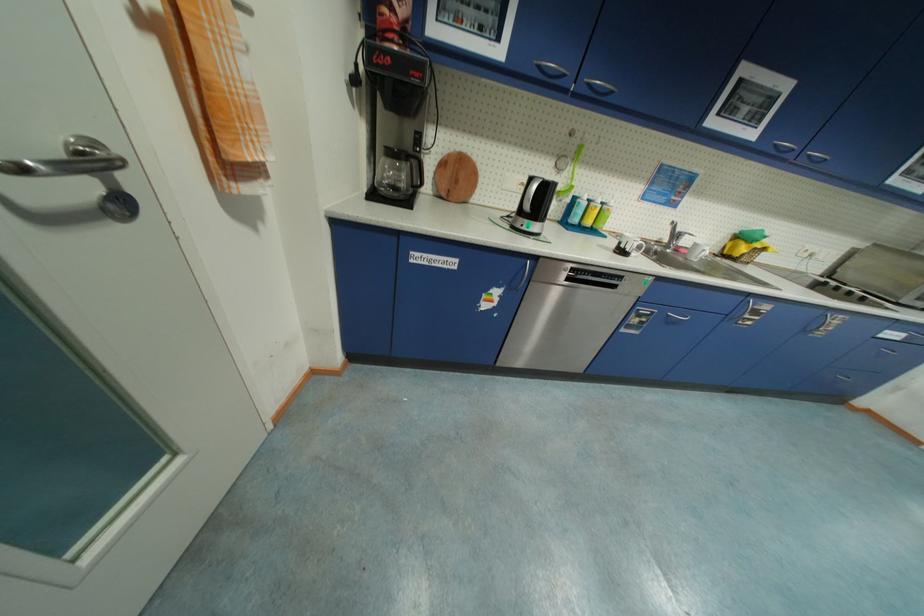
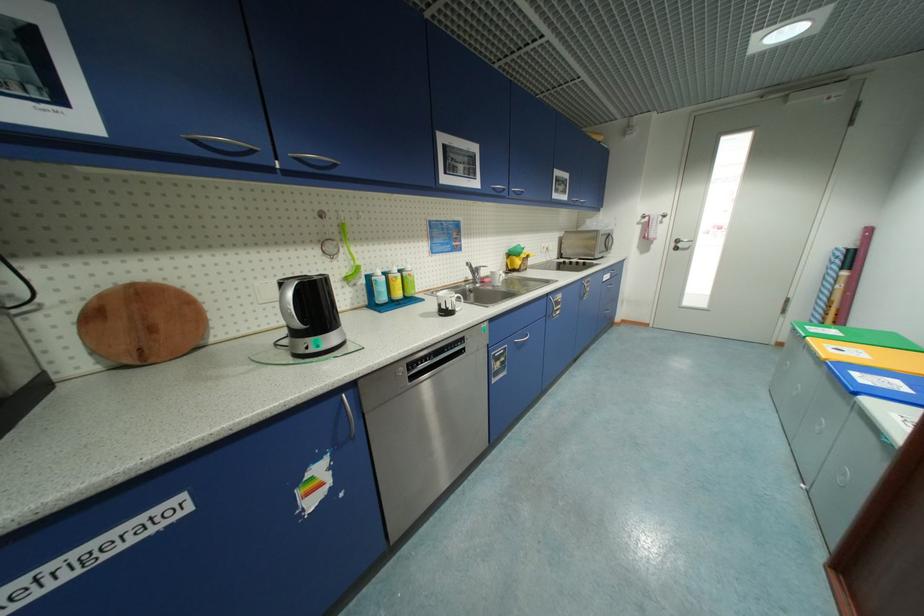
Question: I am providing you with two images of the same scene from different viewpoints. Please identify which objects are invisible in image2.

Choices:
 (A) black mug handle
 (B) green bin lid
 (C) silver cabinet handle
 (D) none of these

Answer: (D)